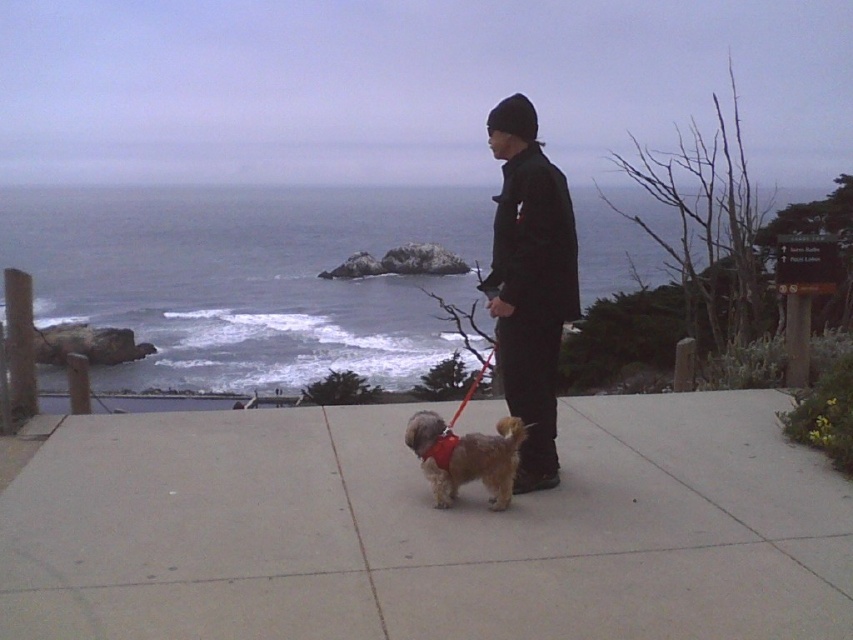
Between point (393, 412) and point (508, 365), which one is positioned in front?

Point (508, 365) is in front.

Is point (718, 531) more distant than point (570, 241)?

No, it is not.

Where is `concrete sidewalk at center`? Image resolution: width=853 pixels, height=640 pixels. concrete sidewalk at center is located at coordinates (426, 531).

Locate an element on the screen. Image resolution: width=853 pixels, height=640 pixels. concrete sidewalk at center is located at coordinates (426, 531).

Between point (772, 497) and point (418, 454), which one is positioned in front?

Point (418, 454) is more forward.

Does point (508, 538) lie behind point (460, 452)?

No, it is in front of (460, 452).

Where is `concrete sidewalk at center`? The image size is (853, 640). concrete sidewalk at center is located at coordinates (426, 531).

Can you confirm if black matte jacket at center is shorter than fuzzy brown dog at center?

In fact, black matte jacket at center may be taller than fuzzy brown dog at center.

Is point (509, 195) positioned before point (485, 468)?

That is False.

I want to click on black matte jacket at center, so tap(531, 282).